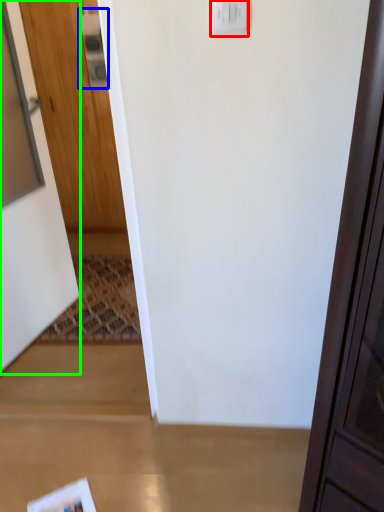
Question: Estimate the real-world distances between objects in this image. Which object is closer to light switch (highlighted by a red box), light switch (highlighted by a blue box) or door (highlighted by a green box)?

Choices:
 (A) light switch
 (B) door

Answer: (B)